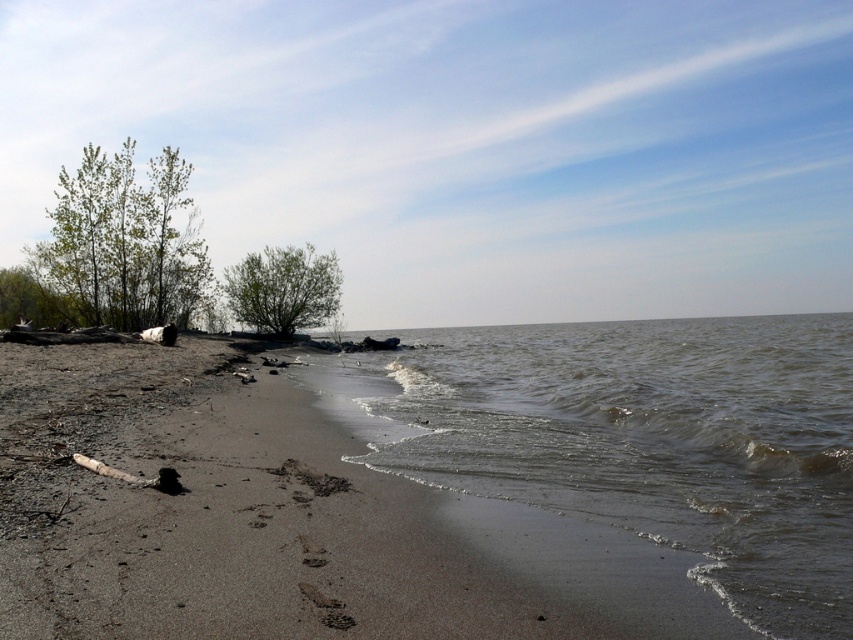
Is point (79, 196) closer to camera compared to point (253, 269)?

Yes, it is in front of point (253, 269).

Looking at this image, does green leafy trees at upper left have a lesser width compared to green matte tree at center?

In fact, green leafy trees at upper left might be wider than green matte tree at center.

Is point (137, 307) positioned behind point (231, 312)?

No, it is in front of (231, 312).

You are a GUI agent. You are given a task and a screenshot of the screen. Output one action in this format:
    pyautogui.click(x=<x>, y=<y>)
    Task: Click on the green leafy trees at upper left
    This screenshot has height=640, width=853.
    Given the screenshot: What is the action you would take?
    pyautogui.click(x=125, y=241)

Who is positioned more to the left, brown murky water at lower left or green leafy trees at upper left?

green leafy trees at upper left

Which is in front, point (733, 547) or point (119, 317)?

Point (733, 547)

Locate an element on the screen. brown murky water at lower left is located at coordinates (645, 440).

Which is more to the right, brown murky water at lower left or green matte tree at center?

brown murky water at lower left

Which is in front, point (805, 596) or point (259, 330)?

Point (805, 596) is more forward.

Identify the location of brown murky water at lower left. This screenshot has width=853, height=640. (645, 440).